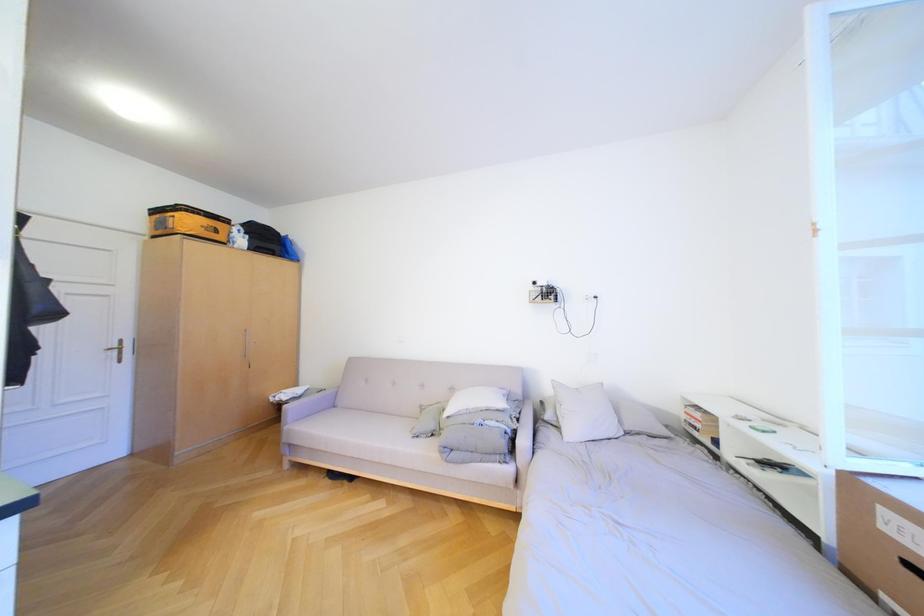
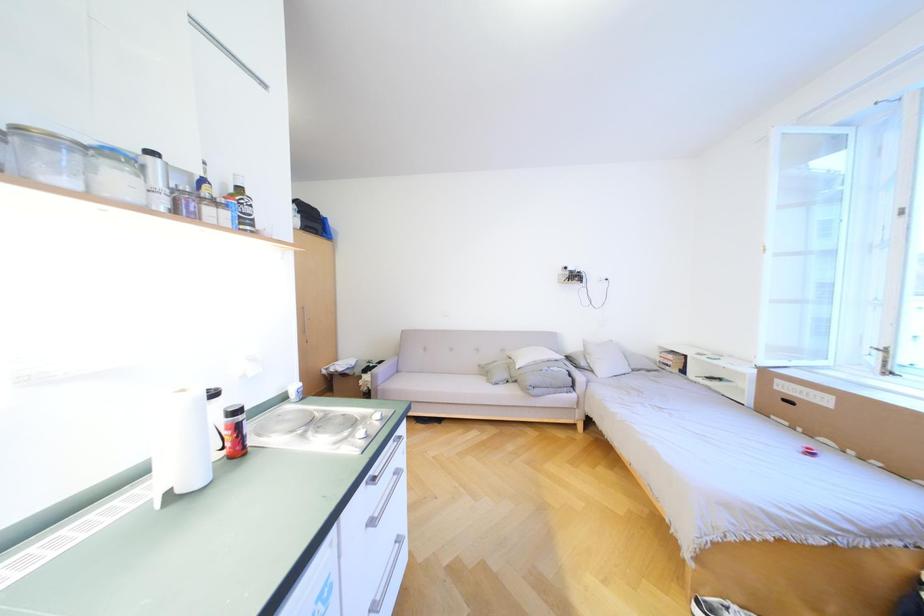
Which direction would the cameraman need to move to produce the second image?

The cameraman moved toward left, backward.